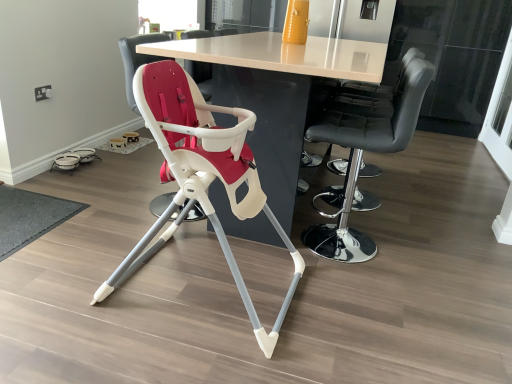
Locate an element on the screen. free area in between black leather bar stool at right, marked as the third chair in a left-to-right arrangement, and white glossy table at center is located at coordinates (371, 210).